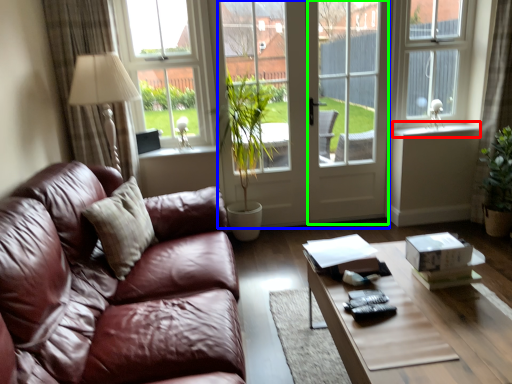
Question: Estimate the real-world distances between objects in this image. Which object is farther from window sill (highlighted by a red box), screen door (highlighted by a blue box) or screen door (highlighted by a green box)?

Choices:
 (A) screen door
 (B) screen door

Answer: (A)